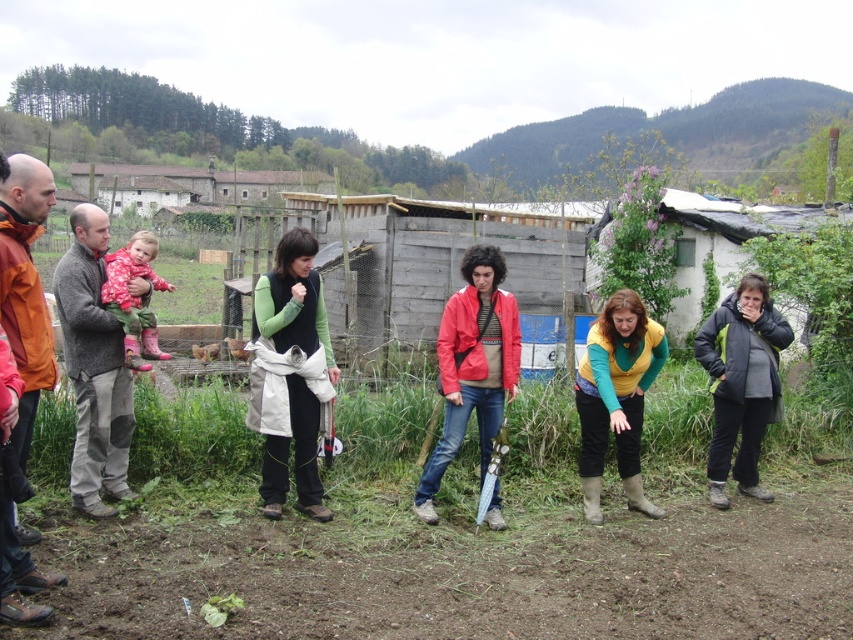
Can you confirm if knitted wool sweater at left is smaller than orange matte jacket at left?

No, knitted wool sweater at left is not smaller than orange matte jacket at left.

You are a GUI agent. You are given a task and a screenshot of the screen. Output one action in this format:
    pyautogui.click(x=<x>, y=<y>)
    Task: Click on the knitted wool sweater at left
    
    Given the screenshot: What is the action you would take?
    coord(93,368)

Describe the element at coordinates (93, 368) in the screenshot. I see `knitted wool sweater at left` at that location.

The image size is (853, 640). I want to click on knitted wool sweater at left, so click(93, 368).

Who is more forward, (x=100, y=477) or (x=590, y=358)?

Point (x=100, y=477) is in front.

Between knitted wool sweater at left and yellow-green sweater at center, which one is positioned higher?

knitted wool sweater at left is above.

Measure the distance between point (73,241) and camera.

A distance of 5.44 meters exists between point (73,241) and camera.

Identify the location of knitted wool sweater at left. Image resolution: width=853 pixels, height=640 pixels. (93, 368).

Is knitted wool sweater at left positioned before fluffy pink boots at left?

Yes, knitted wool sweater at left is in front of fluffy pink boots at left.

Can you confirm if knitted wool sweater at left is taller than fluffy pink boots at left?

Yes.

This screenshot has height=640, width=853. Describe the element at coordinates (93, 368) in the screenshot. I see `knitted wool sweater at left` at that location.

Locate an element on the screen. Image resolution: width=853 pixels, height=640 pixels. knitted wool sweater at left is located at coordinates (93, 368).